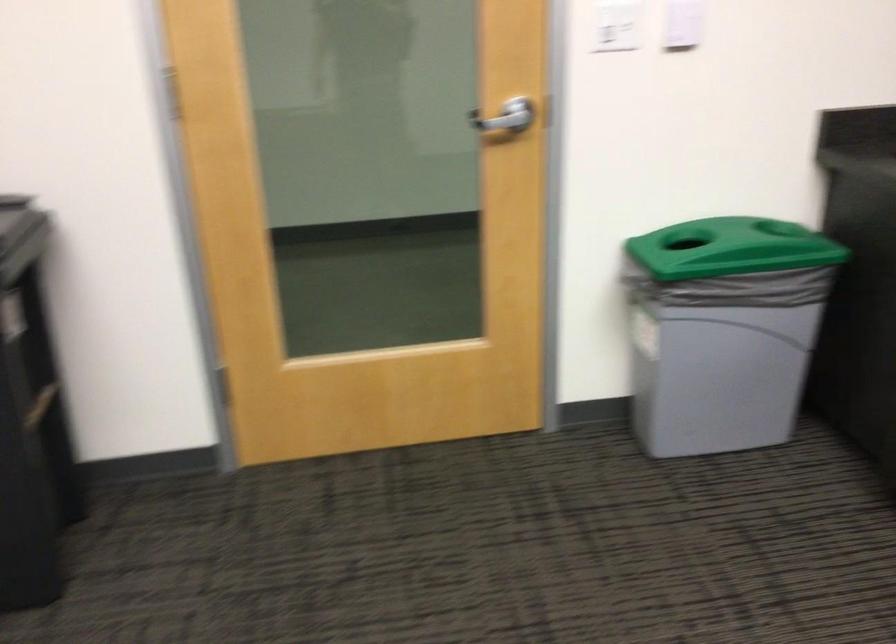
The width and height of the screenshot is (896, 644). What do you see at coordinates (504, 116) in the screenshot?
I see `a silver door handle` at bounding box center [504, 116].